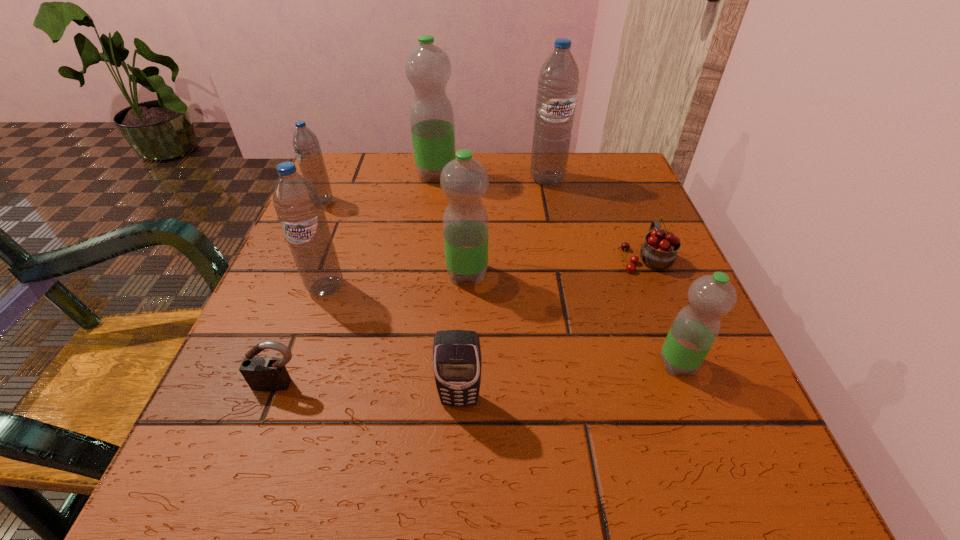
At what (x,y) coordinates should I click in order to perform the action: click on unoccupied position between the second nearest green water bottle and the nearest water bottle. Please return your answer as a coordinate pair (x, y). Looking at the image, I should click on (572, 319).

Where is `vacant area between the biggest green water bottle and the nearest blue water bottle`? The width and height of the screenshot is (960, 540). vacant area between the biggest green water bottle and the nearest blue water bottle is located at coordinates (381, 231).

Image resolution: width=960 pixels, height=540 pixels. I want to click on free spot between the third shortest object and the second water bottle from right to left, so click(503, 289).

Point out which object is positioned as the sixth nearest to the second nearest green water bottle. Please provide its 2D coordinates. Your answer should be formatted as a tuple, i.e. [(x, y)], where the tuple contains the x and y coordinates of a point satisfying the conditions above.

[(261, 373)]

I want to click on the second closest object to the second biggest green water bottle, so pos(457,361).

This screenshot has height=540, width=960. Identify the location of water bottle that stands as the fifth closest to the padlock. (428, 68).

Identify which water bottle is the third nearest to the red cherry. Please provide its 2D coordinates. Your answer should be formatted as a tuple, i.e. [(x, y)], where the tuple contains the x and y coordinates of a point satisfying the conditions above.

[(464, 180)]

The image size is (960, 540). Find the location of `green water bottle that is the third nearest to the smallest blue water bottle`. green water bottle that is the third nearest to the smallest blue water bottle is located at coordinates (695, 328).

This screenshot has height=540, width=960. What are the coordinates of `green water bottle that can be found as the closest to the second smallest green water bottle` in the screenshot? It's located at (428, 68).

Where is `blue water bottle that is the closest to the second biggest green water bottle`? The image size is (960, 540). blue water bottle that is the closest to the second biggest green water bottle is located at coordinates (298, 206).